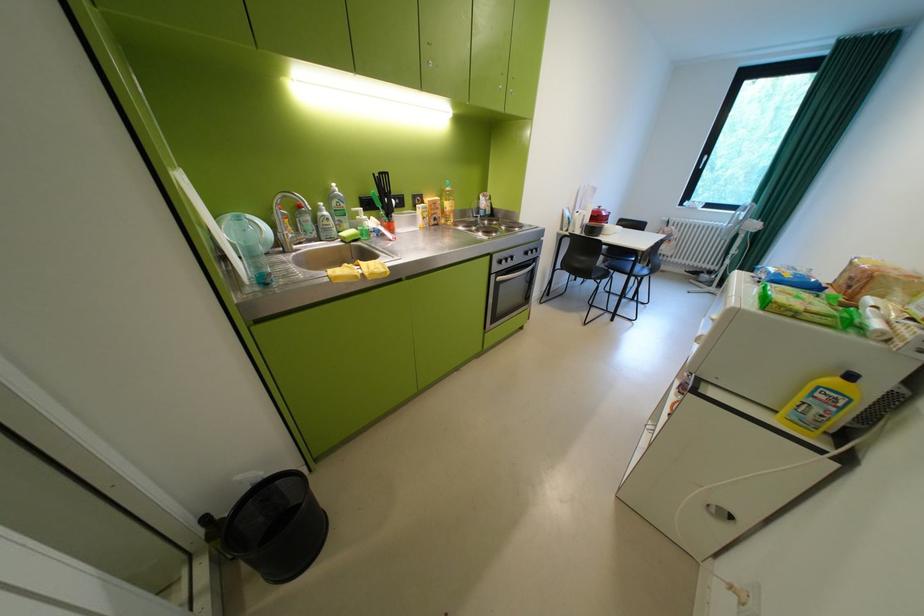
What do you see at coordinates (284, 220) in the screenshot? Image resolution: width=924 pixels, height=616 pixels. I see `the faucet handle` at bounding box center [284, 220].